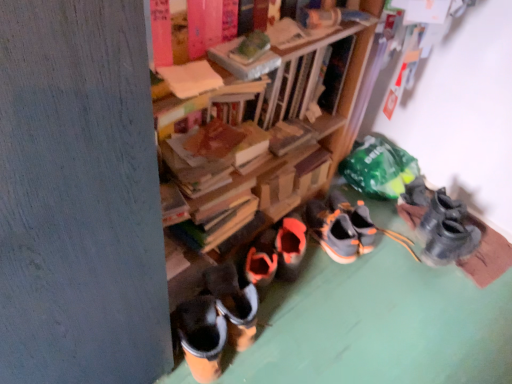
Where is `free location to the right of matte gray sneakers at right, acting as the third footwear starting from the left`? Image resolution: width=512 pixels, height=384 pixels. free location to the right of matte gray sneakers at right, acting as the third footwear starting from the left is located at coordinates (489, 239).